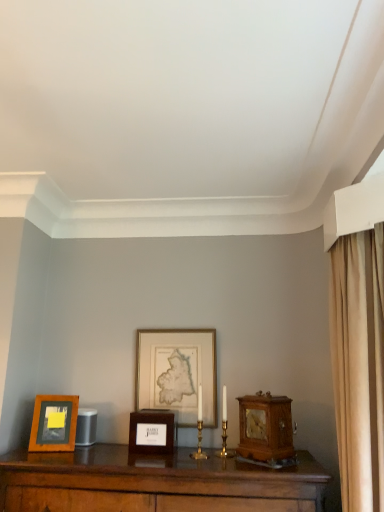
Measure the distance between point (58, 408) and camera.

Point (58, 408) is 6.71 feet away from camera.

Identify the location of wooden picture frame at left, the third picture frame in the right-to-left sequence. (54, 423).

In the scene shown: What is the approximate height of gold-framed map at center, the third picture frame from the left?

gold-framed map at center, the third picture frame from the left, is 21.01 inches in height.

Identify the location of wooden alarm clock at right. (265, 426).

The image size is (384, 512). I want to click on wooden picture frame at left, the third picture frame in the right-to-left sequence, so [54, 423].

Could you tell me if wooden alarm clock at right is facing wooden picture frame at center, which is the second picture frame from left to right?

No, wooden alarm clock at right does not turn towards wooden picture frame at center, which is the second picture frame from left to right.

Is there a large distance between wooden alarm clock at right and wooden picture frame at center, which is the second picture frame from left to right?

No, wooden alarm clock at right is not far away from wooden picture frame at center, which is the second picture frame from left to right.

Which is in front, wooden alarm clock at right or wooden picture frame at center, which is the second picture frame from left to right?

wooden alarm clock at right is closer to the camera.

The image size is (384, 512). Identify the location of picture frame above the wooden picture frame at left, which ranks as the first picture frame in left-to-right order (from a real-world perspective). (177, 373).

Does gold-framed map at center, which is the first picture frame in right-to-left order, come behind wooden picture frame at left, which ranks as the first picture frame in left-to-right order?

Yes, gold-framed map at center, which is the first picture frame in right-to-left order, is further from the viewer.

Is point (166, 364) closer to camera compared to point (57, 436)?

No, it is behind (57, 436).

Between gold-framed map at center, the third picture frame from the left, and wooden picture frame at left, which ranks as the first picture frame in left-to-right order, which one has larger size?

gold-framed map at center, the third picture frame from the left.

Is wooden picture frame at left, the third picture frame in the right-to-left sequence, bigger or smaller than wooden alarm clock at right?

Considering their sizes, wooden picture frame at left, the third picture frame in the right-to-left sequence, takes up less space than wooden alarm clock at right.

Could wooden alarm clock at right be considered to be inside wooden picture frame at left, the third picture frame in the right-to-left sequence?

No, wooden alarm clock at right is not surrounded by wooden picture frame at left, the third picture frame in the right-to-left sequence.

Identify the location of alarm clock in front of the wooden picture frame at left, the third picture frame in the right-to-left sequence. The height and width of the screenshot is (512, 384). (265, 426).

From a real-world perspective, is wooden picture frame at left, the third picture frame in the right-to-left sequence, physically located above or below wooden alarm clock at right?

In terms of real-world spatial position, wooden picture frame at left, the third picture frame in the right-to-left sequence, is below wooden alarm clock at right.

From the picture: From a real-world perspective, who is located higher, gold-framed map at center, which is the first picture frame in right-to-left order, or wooden alarm clock at right?

In real-world perspective, gold-framed map at center, which is the first picture frame in right-to-left order, is above.

Considering the positions of point (144, 335) and point (245, 404), is point (144, 335) closer or farther from the camera than point (245, 404)?

Point (144, 335) is positioned farther from the camera compared to point (245, 404).

Considering the positions of objects gold-framed map at center, which is the first picture frame in right-to-left order, and wooden alarm clock at right in the image provided, who is more to the right, gold-framed map at center, which is the first picture frame in right-to-left order, or wooden alarm clock at right?

wooden alarm clock at right.

Is gold-framed map at center, the third picture frame from the left, located outside wooden alarm clock at right?

gold-framed map at center, the third picture frame from the left, lies outside wooden alarm clock at right's area.

Is the position of wooden picture frame at left, which ranks as the first picture frame in left-to-right order, more distant than that of gold-framed map at center, the third picture frame from the left?

No, wooden picture frame at left, which ranks as the first picture frame in left-to-right order, is closer to the camera.

Is wooden picture frame at left, the third picture frame in the right-to-left sequence, aimed at gold-framed map at center, which is the first picture frame in right-to-left order?

No, wooden picture frame at left, the third picture frame in the right-to-left sequence, is not turned towards gold-framed map at center, which is the first picture frame in right-to-left order.

Is gold-framed map at center, the third picture frame from the left, inside wooden picture frame at left, the third picture frame in the right-to-left sequence?

No, wooden picture frame at left, the third picture frame in the right-to-left sequence, does not contain gold-framed map at center, the third picture frame from the left.

Is wooden picture frame at left, the third picture frame in the right-to-left sequence, smaller than wooden picture frame at center, which is the second picture frame from left to right?

Indeed, wooden picture frame at left, the third picture frame in the right-to-left sequence, has a smaller size compared to wooden picture frame at center, which is the second picture frame from left to right.

How different are the orientations of wooden picture frame at left, which ranks as the first picture frame in left-to-right order, and wooden picture frame at center, which is the second picture frame from left to right, in degrees?

19.3 degrees separate the facing orientations of wooden picture frame at left, which ranks as the first picture frame in left-to-right order, and wooden picture frame at center, which is the second picture frame from left to right.

Is wooden picture frame at left, which ranks as the first picture frame in left-to-right order, next to wooden picture frame at center, which is the 2th picture frame in right-to-left order, and touching it?

wooden picture frame at left, which ranks as the first picture frame in left-to-right order, and wooden picture frame at center, which is the 2th picture frame in right-to-left order, are not in contact.

Can wooden picture frame at center, which is the 2th picture frame in right-to-left order, be found inside wooden picture frame at left, the third picture frame in the right-to-left sequence?

No, wooden picture frame at left, the third picture frame in the right-to-left sequence, does not contain wooden picture frame at center, which is the 2th picture frame in right-to-left order.

Who is more distant, wooden picture frame at center, which is the second picture frame from left to right, or wooden alarm clock at right?

wooden picture frame at center, which is the second picture frame from left to right.

Is wooden picture frame at center, which is the second picture frame from left to right, at the right side of wooden alarm clock at right?

Incorrect, wooden picture frame at center, which is the second picture frame from left to right, is not on the right side of wooden alarm clock at right.

Considering the positions of point (156, 416) and point (268, 405), is point (156, 416) closer or farther from the camera than point (268, 405)?

Point (156, 416) appears to be farther away from the viewer than point (268, 405).

Which picture frame is the 2nd one when counting from the left side of the wooden alarm clock at right? Please provide its 2D coordinates.

[(151, 432)]

Where is `picture frame that is the 2nd object located in front of the gold-framed map at center, the third picture frame from the left`? Image resolution: width=384 pixels, height=512 pixels. picture frame that is the 2nd object located in front of the gold-framed map at center, the third picture frame from the left is located at coordinates click(54, 423).

Considering their positions, is gold-framed map at center, the third picture frame from the left, positioned closer to wooden picture frame at center, which is the second picture frame from left to right, than wooden picture frame at left, the third picture frame in the right-to-left sequence?

gold-framed map at center, the third picture frame from the left, lies closer to wooden picture frame at center, which is the second picture frame from left to right, than the other object.

Which object lies further to the anchor point wooden picture frame at left, which ranks as the first picture frame in left-to-right order, gold-framed map at center, the third picture frame from the left, or wooden picture frame at center, which is the 2th picture frame in right-to-left order?

Based on the image, gold-framed map at center, the third picture frame from the left, appears to be further to wooden picture frame at left, which ranks as the first picture frame in left-to-right order.

Which object lies nearer to the anchor point gold-framed map at center, which is the first picture frame in right-to-left order, wooden picture frame at center, which is the second picture frame from left to right, or wooden picture frame at left, which ranks as the first picture frame in left-to-right order?

wooden picture frame at center, which is the second picture frame from left to right, lies closer to gold-framed map at center, which is the first picture frame in right-to-left order, than the other object.

Consider the image. Estimate the real-world distances between objects in this image. Which object is further from wooden picture frame at center, which is the 2th picture frame in right-to-left order, wooden alarm clock at right or gold-framed map at center, which is the first picture frame in right-to-left order?

Based on the image, wooden alarm clock at right appears to be further to wooden picture frame at center, which is the 2th picture frame in right-to-left order.

Looking at the image, which one is located further to wooden alarm clock at right, wooden picture frame at left, the third picture frame in the right-to-left sequence, or gold-framed map at center, the third picture frame from the left?

wooden picture frame at left, the third picture frame in the right-to-left sequence, is further to wooden alarm clock at right.

Consider the image. Based on their spatial positions, is wooden picture frame at left, which ranks as the first picture frame in left-to-right order, or wooden alarm clock at right closer to wooden picture frame at center, which is the second picture frame from left to right?

wooden picture frame at left, which ranks as the first picture frame in left-to-right order, is positioned closer to the anchor wooden picture frame at center, which is the second picture frame from left to right.

When comparing their distances from wooden picture frame at left, which ranks as the first picture frame in left-to-right order, does wooden alarm clock at right or wooden picture frame at center, which is the 2th picture frame in right-to-left order, seem closer?

Among the two, wooden picture frame at center, which is the 2th picture frame in right-to-left order, is located nearer to wooden picture frame at left, which ranks as the first picture frame in left-to-right order.

Looking at the image, which one is located further to gold-framed map at center, which is the first picture frame in right-to-left order, wooden alarm clock at right or wooden picture frame at center, which is the second picture frame from left to right?

wooden alarm clock at right is further to gold-framed map at center, which is the first picture frame in right-to-left order.

Find the location of a particular element. picture frame between wooden picture frame at center, which is the 2th picture frame in right-to-left order, and wooden alarm clock at right, in the horizontal direction is located at coordinates (177, 373).

I want to click on picture frame between wooden picture frame at left, which ranks as the first picture frame in left-to-right order, and gold-framed map at center, which is the first picture frame in right-to-left order, so click(151, 432).